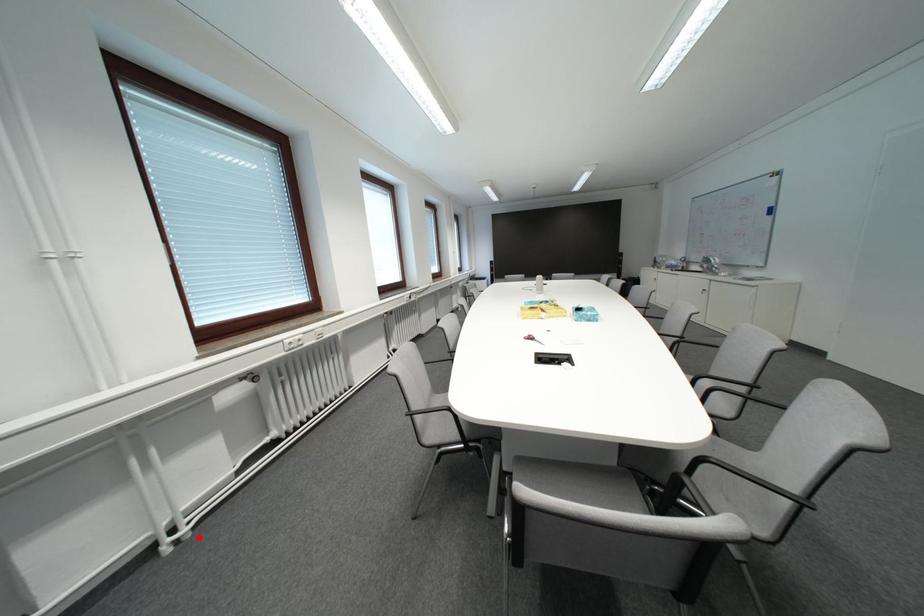
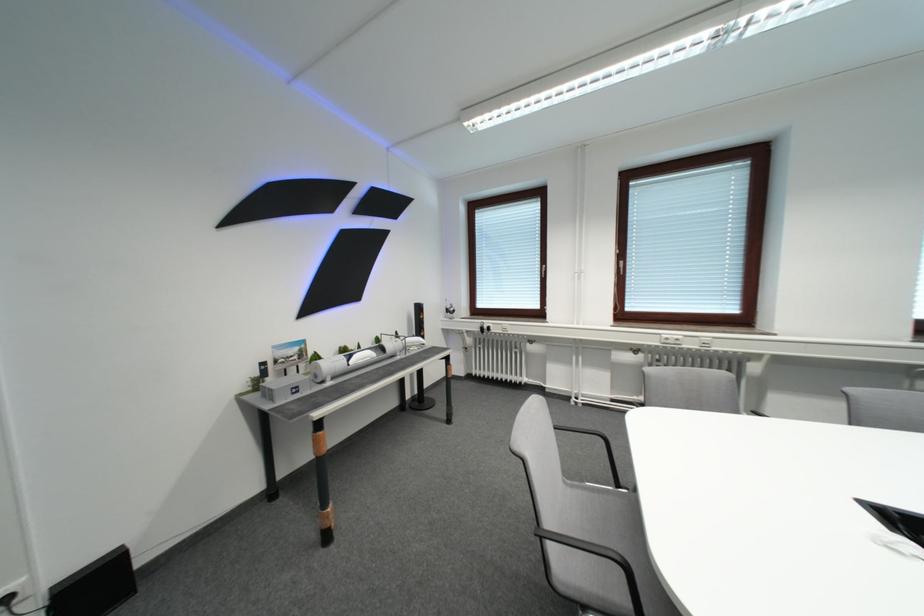
The point at the highlighted location is marked in the first image. Where is the corresponding point in the second image?

(590, 408)